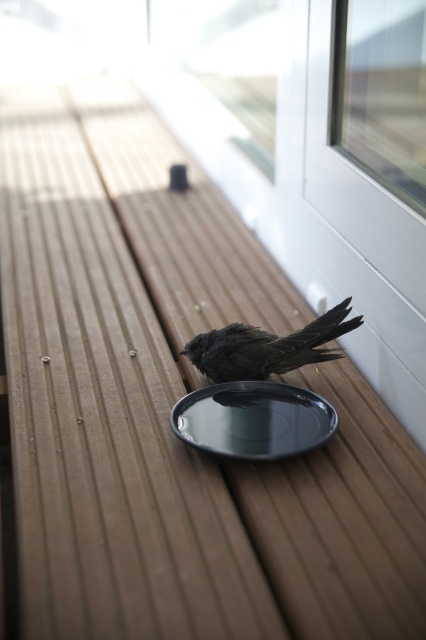
Looking at this image, you are a delivery person trying to reach the doorbell located near the dark matte bird at center. However, there is a transparent plastic screen door at upper right in the way. Can you still ring the doorbell without opening the screen door?

The transparent plastic screen door at upper right is above the dark matte bird at center, so the doorbell is likely located below the screen door. Therefore, you can still reach the doorbell without opening the screen door by going around the transparent plastic screen door at upper right.

You are a delivery person trying to place a package on the deck. The package is as wide as the shiny black plate at center. Can you fit the package through the transparent plastic screen door at upper right without rotating it?

The transparent plastic screen door at upper right is narrower than the shiny black plate at center. Since the package is as wide as the plate, it won me be able to fit through the door without rotating it.

You are standing on the wooden deck and want to pick up an object. There are two points marked on the deck at coordinates point [285,451] and point [325,358]. Which point is closer to you?

Point [285,451] is closer to the camera than point [325,358], so you should pick up the object at point [285,451] first as it is nearer to you.